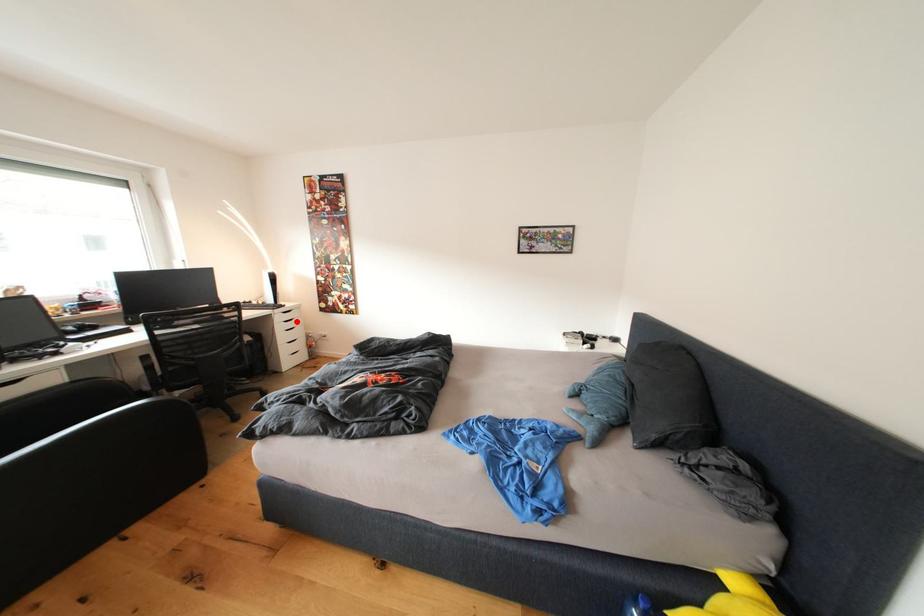
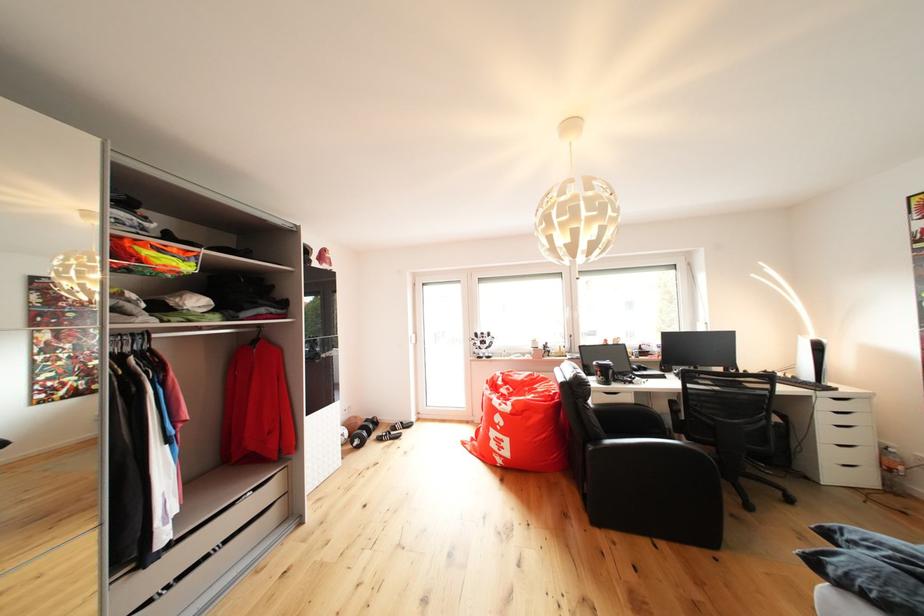
Locate, in the second image, the point that corresponds to the highlighted location in the first image.

(850, 411)